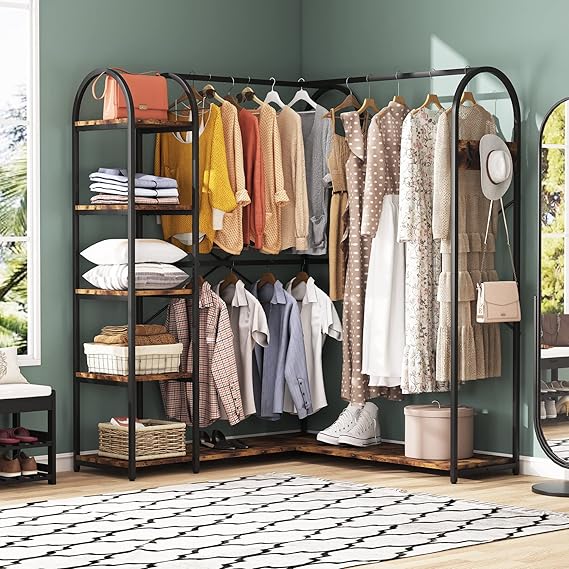
You are a GUI agent. You are given a task and a screenshot of the screen. Output one action in this format:
    pyautogui.click(x=<x>, y=<y>)
    Task: Click on the shelf panel frames
    The width and height of the screenshot is (569, 569).
    Given the screenshot: What is the action you would take?
    pyautogui.click(x=114, y=123), pyautogui.click(x=113, y=211), pyautogui.click(x=108, y=295), pyautogui.click(x=101, y=382), pyautogui.click(x=100, y=465), pyautogui.click(x=483, y=468)